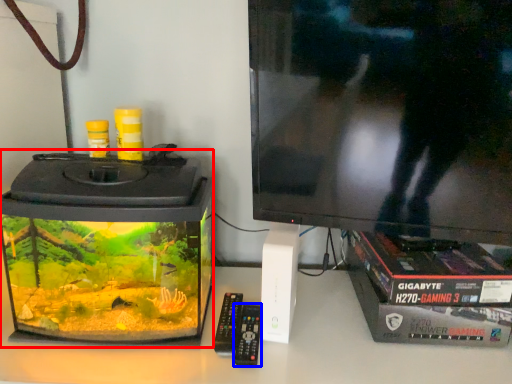
Question: Among these objects, which one is nearest to the camera, appliance (highlighted by a red box) or control (highlighted by a blue box)?

Choices:
 (A) appliance
 (B) control

Answer: (A)